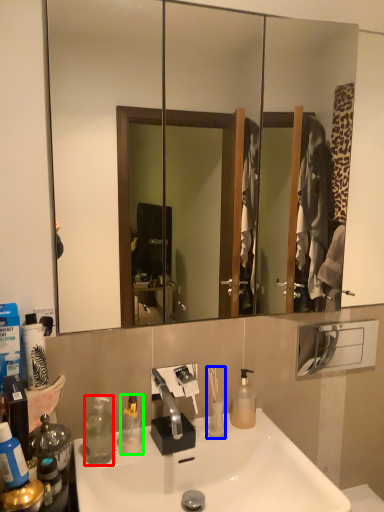
Question: Estimate the real-world distances between objects in this image. Which object is farther from bottle (highlighted by a red box), toiletry (highlighted by a blue box) or bottle (highlighted by a green box)?

Choices:
 (A) toiletry
 (B) bottle

Answer: (A)